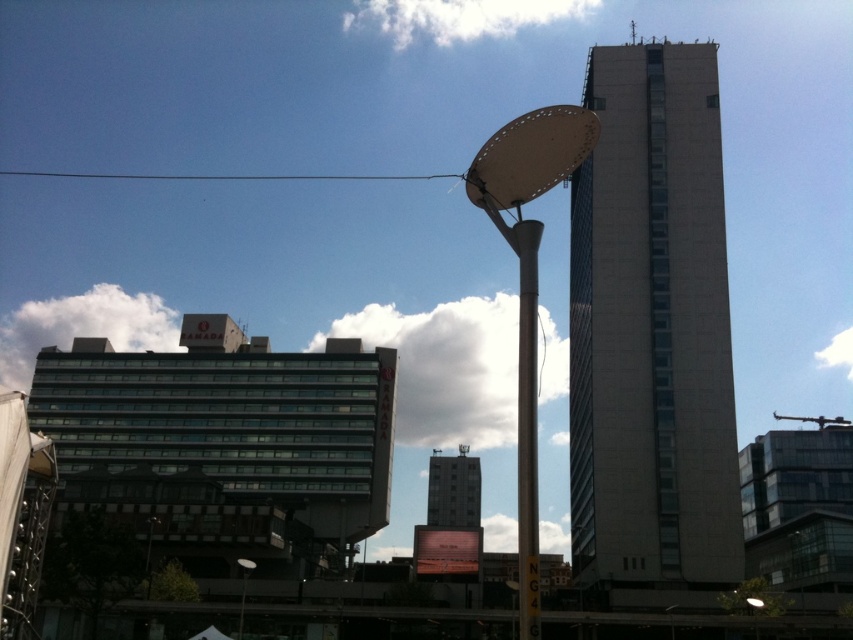
Question: Is gray concrete building at center further to camera compared to white matte lamp post at center?

Choices:
 (A) no
 (B) yes

Answer: (B)

Question: From the image, what is the correct spatial relationship of white matte lamp post at center in relation to metallic pole at center?

Choices:
 (A) left
 (B) right

Answer: (B)

Question: Which object appears farthest from the camera in this image?

Choices:
 (A) metallic pole at center
 (B) metallic pole at lower left
 (C) gray concrete tower at center
 (D) silver metallic pole at center

Answer: (C)

Question: Is gray concrete building at center behind metallic satellite dish at upper center?

Choices:
 (A) yes
 (B) no

Answer: (B)

Question: Which is nearer to the gray concrete building at center?

Choices:
 (A) white matte lamp post at center
 (B) silver metallic pole at center
 (C) metallic pole at center

Answer: (A)

Question: Among these points, which one is nearest to the camera?

Choices:
 (A) (248, 566)
 (B) (469, 497)
 (C) (634, 26)
 (D) (149, 536)

Answer: (A)